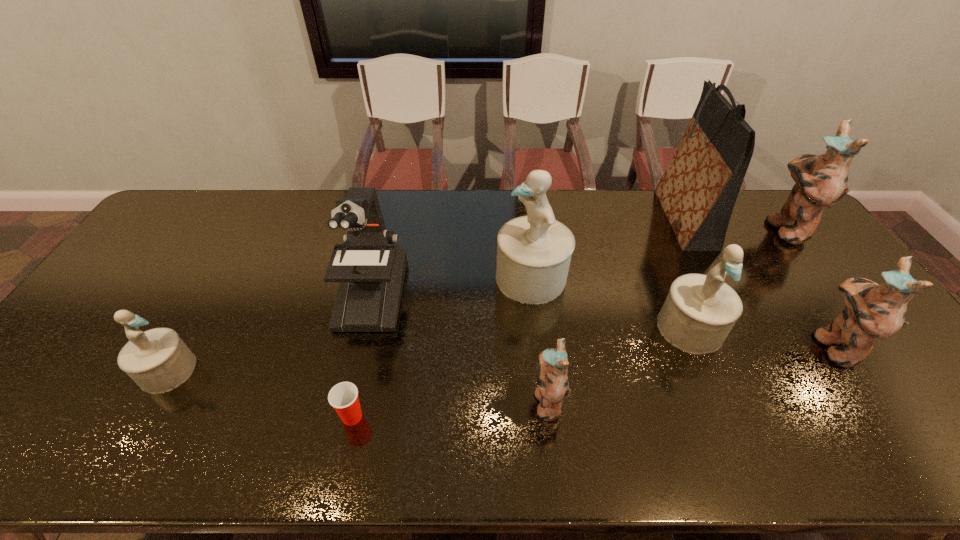
In the image, there is a desktop. At what (x,y) coordinates should I click in order to perform the action: click on vacant space at the right edge. Please return your answer as a coordinate pair (x, y). The width and height of the screenshot is (960, 540). Looking at the image, I should click on (789, 272).

This screenshot has height=540, width=960. Identify the location of vacant area at the far left corner. (182, 197).

Image resolution: width=960 pixels, height=540 pixels. What are the coordinates of `free space between the leftmost pink figurine and the second white figurine from right to left` in the screenshot? It's located at (540, 340).

The width and height of the screenshot is (960, 540). Identify the location of free spot between the shopping bag and the rightmost white figurine. (x=686, y=273).

You are a GUI agent. You are given a task and a screenshot of the screen. Output one action in this format:
    pyautogui.click(x=<x>, y=<y>)
    Task: Click on the free space between the microscope and the rightmost white figurine
    Image resolution: width=960 pixels, height=540 pixels.
    Given the screenshot: What is the action you would take?
    pyautogui.click(x=530, y=310)

The height and width of the screenshot is (540, 960). In order to click on free space between the biggest white figurine and the rightmost white figurine in this screenshot , I will do click(611, 302).

Locate an element on the screen. The width and height of the screenshot is (960, 540). vacant space that is in between the shopping bag and the shortest object is located at coordinates [x=517, y=318].

This screenshot has height=540, width=960. I want to click on empty space that is in between the second nearest pink figurine and the third figurine from right to left, so click(x=761, y=336).

This screenshot has width=960, height=540. In order to click on vacant space that's between the Dixie cup and the leftmost figurine in this screenshot , I will do `click(260, 394)`.

Identify the location of blank region between the shortest object and the tallest object. The width and height of the screenshot is (960, 540). (517, 318).